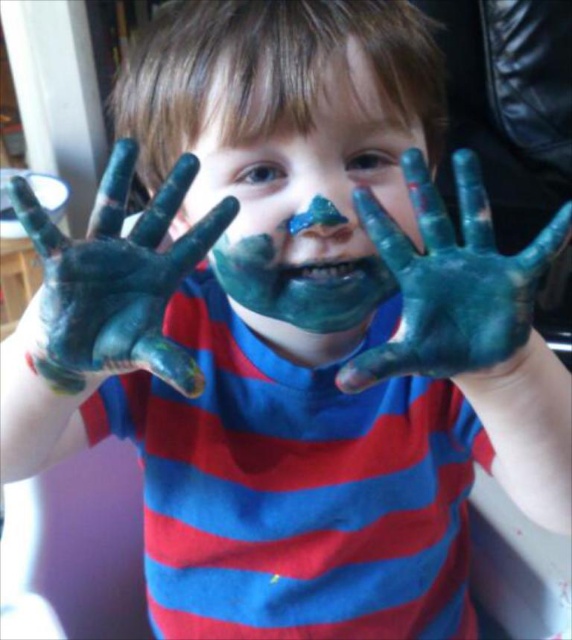
You are an art teacher observing a child in a classroom. You notice the child has two areas of paint on their hands and face. The objects are labeled as matte blue paint at center and blue matte paint at center. Which one is closer to you, the observer?

The matte blue paint at center is closer to you because the blue matte paint at center is behind it.

You are a photographer trying to capture a closeup of the blue matte paint at center without the blue matte hands at center blocking it. Based on the scene, is this possible?

The blue matte paint at center is in front of the blue matte hands at center, so it would block the hands. Therefore, you can capture a closeup of the blue matte paint at center without the blue matte hands at center blocking it.

The child in the image has blue matte paint at center and blue matte hands at center. Which one is bigger?

The blue matte paint at center is larger in size than the blue matte hands at center.